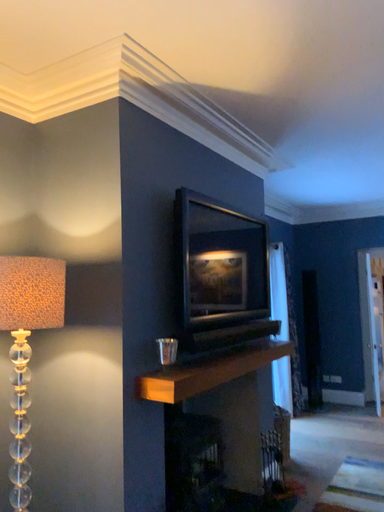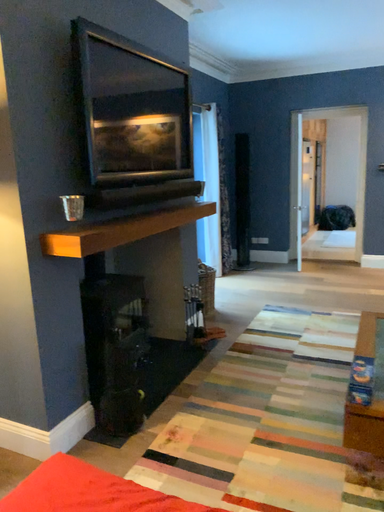
Question: How did the camera likely rotate when shooting the video?

Choices:
 (A) rotated left
 (B) rotated right

Answer: (B)